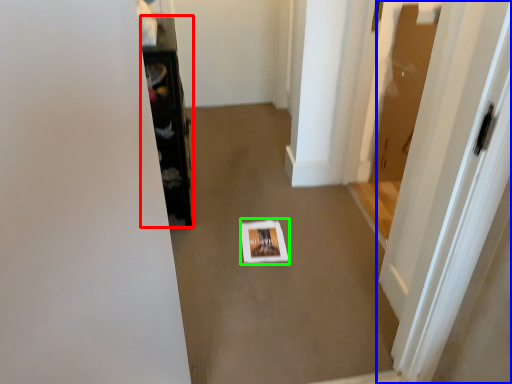
Question: Considering the real-world distances, which object is farthest from furniture (highlighted by a red box)? door (highlighted by a blue box) or square (highlighted by a green box)?

Choices:
 (A) door
 (B) square

Answer: (A)